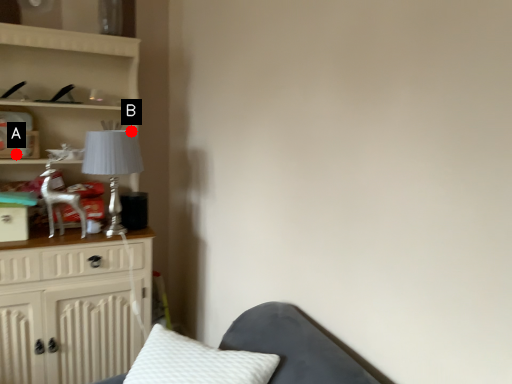
Question: Two points are circled on the image, labeled by A and B beside each circle. Among these points, which one is farthest from the camera?

Choices:
 (A) A is further
 (B) B is further

Answer: (B)